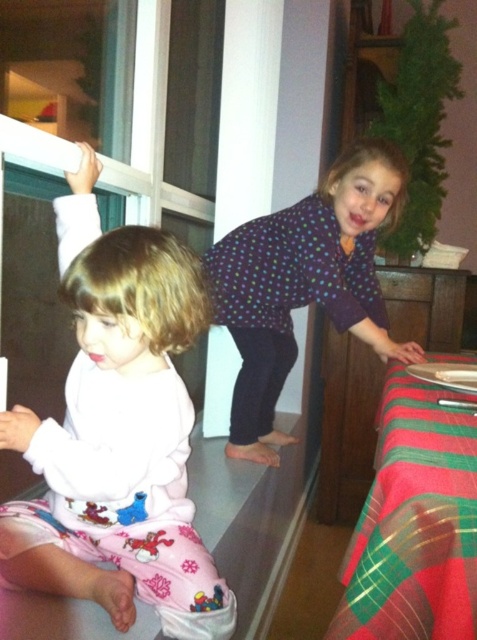
You are a parent trying to retrieve a toy that fell behind the couch. The toy is located at point (35, 566). The couch is 40 inches away from you. Can you reach the toy without moving the couch?

The distance of point (35, 566) is 38.73 inches from the viewer, which is less than the 40 inches distance to the couch. Therefore, you can reach the toy without moving the couch.

You are a parent trying to decide which child to approach first. The white soft pajamas at left is closer to you. Which child should you approach first?

You should approach the child wearing the white soft pajamas at left first because they are only 34.54 inches away from you, making them closer than the other child.

You are a photographer standing in front of the scene. You want to take a closeup photo of the white soft pajamas at left. The camera can only focus on objects within 80 centimeters. Can you take the photo without moving closer?

The white soft pajamas at left are 87.72 centimeters away from the camera, which is beyond the 80 centimeter focus range. Therefore, you cannot take the closeup photo without moving closer.